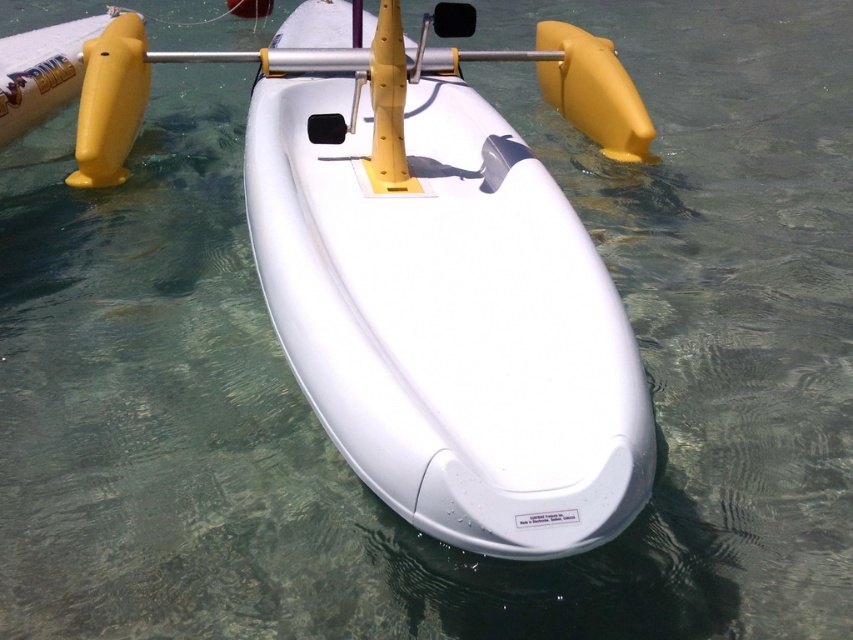
Is point (408, 83) positioned behind point (374, 93)?

Yes, it is behind point (374, 93).

The width and height of the screenshot is (853, 640). Find the location of `white matte kayak at center`. white matte kayak at center is located at coordinates (450, 282).

Where is `white matte kayak at center`? The image size is (853, 640). white matte kayak at center is located at coordinates (450, 282).